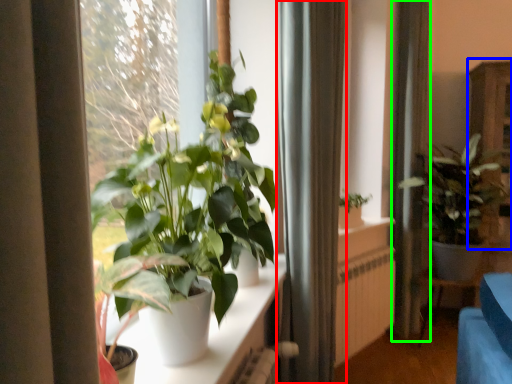
Question: Estimate the real-world distances between objects in this image. Which object is farther from curtain (highlighted by a red box), dresser (highlighted by a blue box) or curtain (highlighted by a green box)?

Choices:
 (A) dresser
 (B) curtain

Answer: (A)